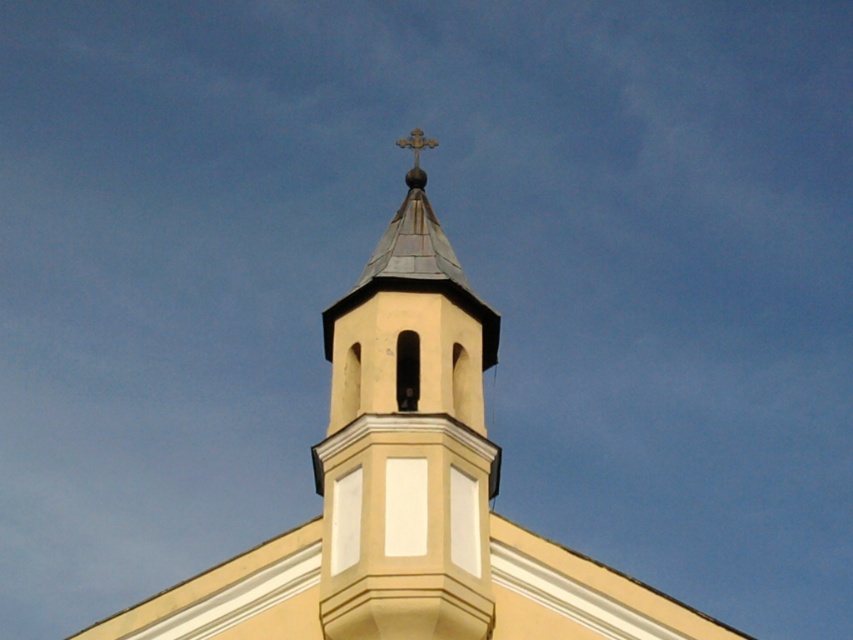
Between point (412, 358) and point (418, 161), which one is positioned behind?

The point (418, 161) is more distant.

Does smooth beige steeple at center have a lesser height compared to gold metallic cross at upper center?

Indeed, smooth beige steeple at center has a lesser height compared to gold metallic cross at upper center.

Find the location of `smooth beige steeple at center`. smooth beige steeple at center is located at coordinates (407, 442).

Find the location of a particular element. smooth beige steeple at center is located at coordinates (407, 442).